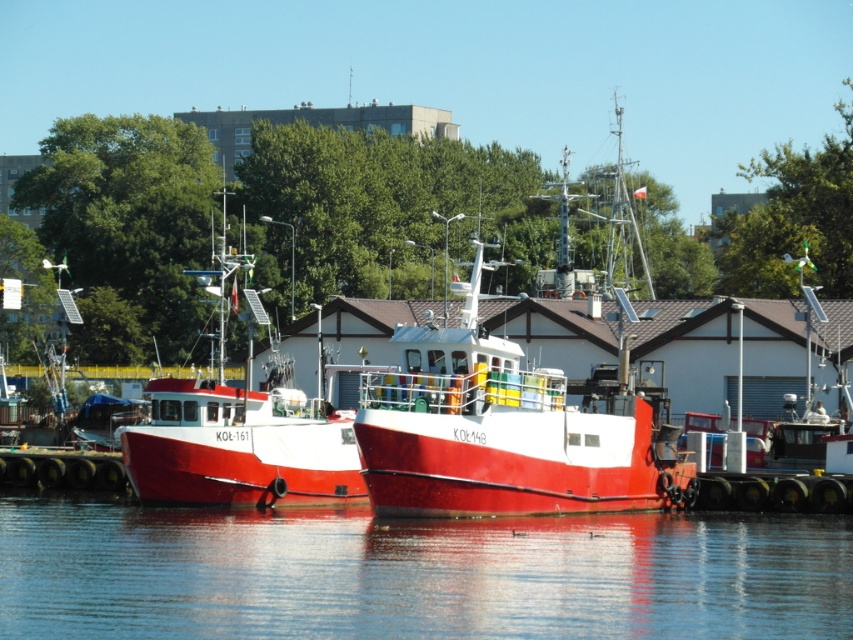
You are standing at the harbor and want to reach a specific point marked at coordinates point (647,477). Given that the distance from your current position to this point is 103.89 meters, can you estimate how far you need to walk to reach it?

The point (647,477) is 103.89 meters away from your current position, so you need to walk approximately 103.89 meters to reach it.

You are a photographer positioned at the edge of the harbor. You want to capture a photo where the transparent water at center is in focus while keeping the shiny red boat at center in the background. Is this possible with your current camera settings?

Yes, because the transparent water at center is closer to the viewer than the shiny red boat at center, so adjusting the focus to the water will naturally place the boat in the background.

You are a dock worker who needs to load heavy equipment onto both the shiny red boat at center and the red matte boat at left. Which boat should you choose to load first if you want to start with the larger vessel?

The red matte boat at left is larger than the shiny red boat at center, so you should load the red matte boat at left first.